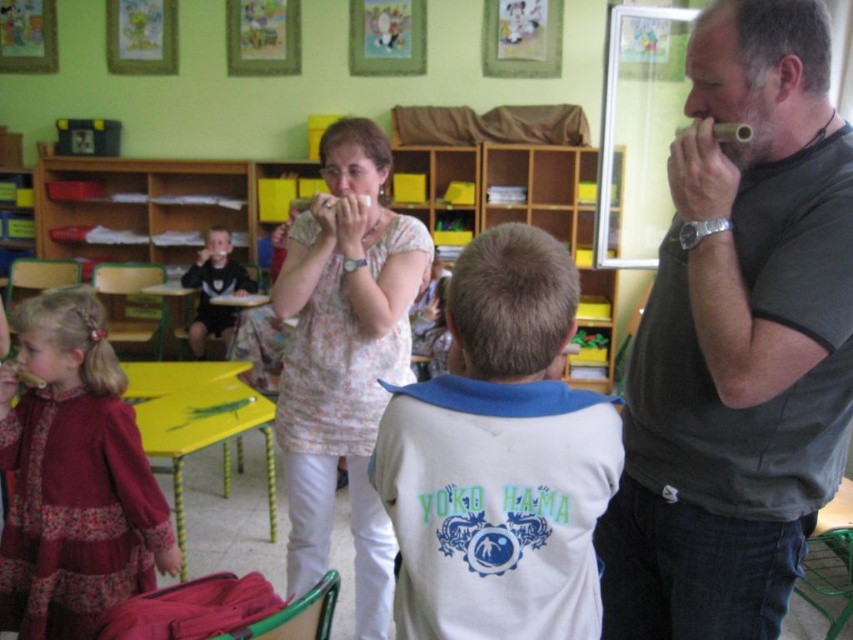
You are a photographer setting up a camera in the classroom. You need to ensure both the floral fabric blouse at center and the black matte shirt at left are clearly visible in the shot. Considering their sizes, which one might require more focus adjustment due to its size?

The floral fabric blouse at center is larger in size than the black matte shirt at left, so it might require more focus adjustment due to its larger size.

You are a photographer standing in the classroom and want to take a photo of both the white cotton shirt at center and the maroon fabric dress at left. You need to ensure they are both in focus. The camera you are using has a depth of field that can cover 1.5 meters. Will both subjects be in focus?

The distance between the white cotton shirt at center and the maroon fabric dress at left is 1.28 meters, which is within the camera depth of field of 1.5 meters. Therefore, both subjects will be in focus.